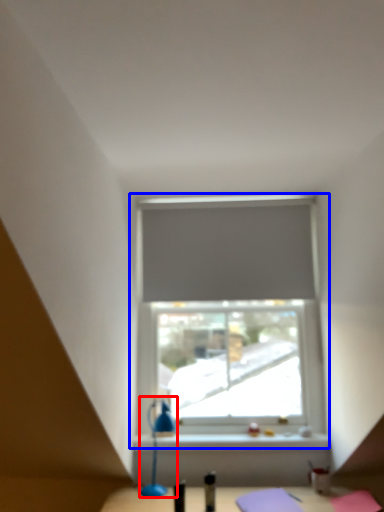
Question: Among these objects, which one is nearest to the camera, table lamp (highlighted by a red box) or window (highlighted by a blue box)?

Choices:
 (A) table lamp
 (B) window

Answer: (A)